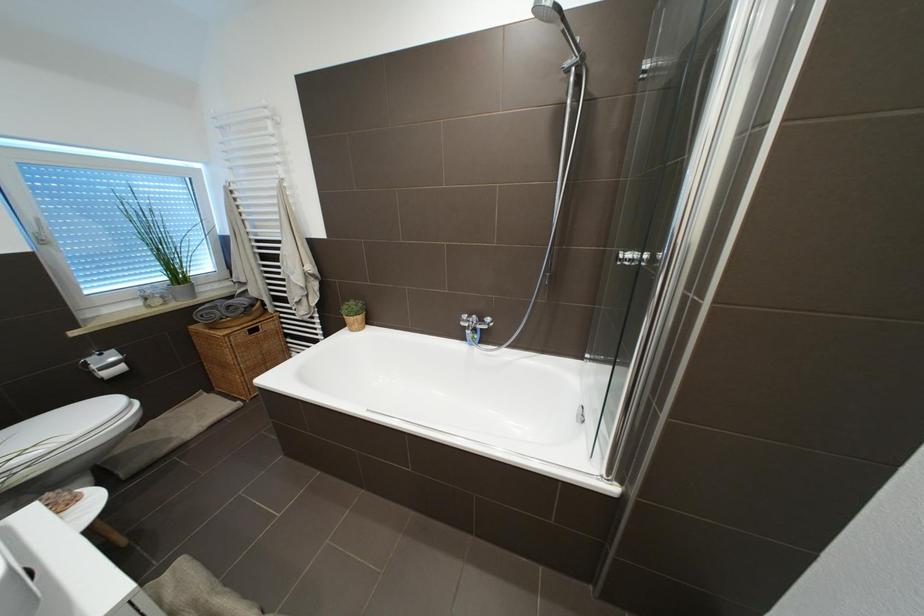
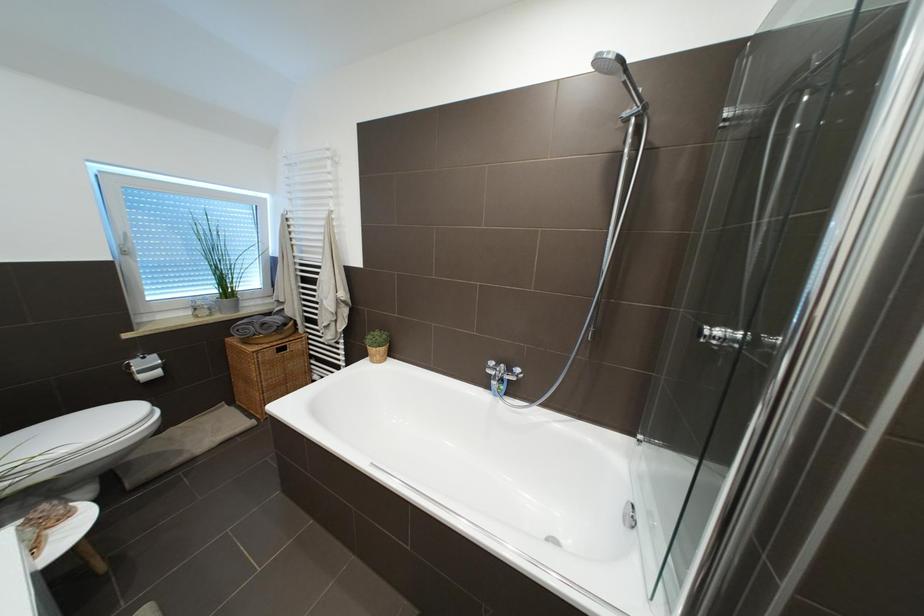
Question: The images are taken continuously from a first-person perspective. In which direction are you moving?

Choices:
 (A) Left
 (B) Right
 (C) Forward
 (D) Backward

Answer: (C)